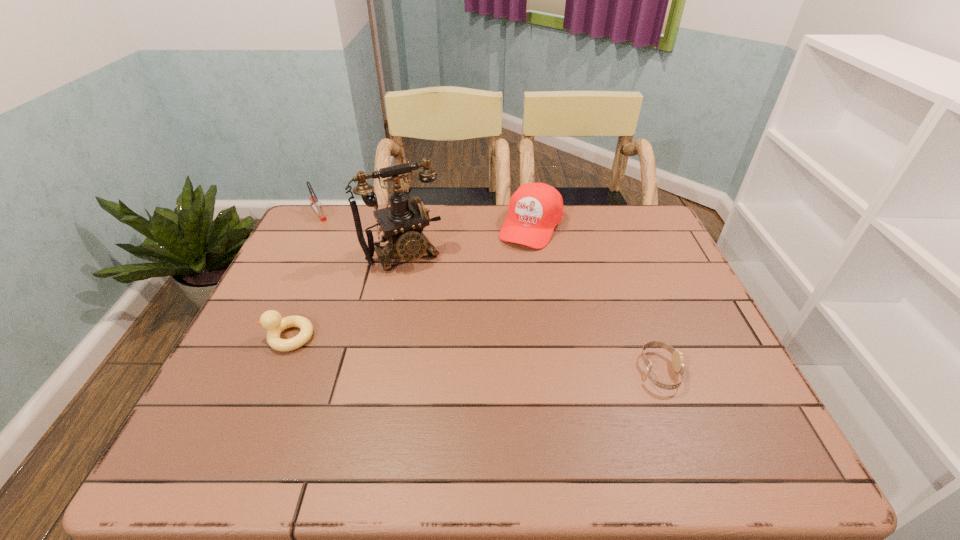
Find the location of a particular element. vacant space located 0.370m on the rotary dial of the tallest object is located at coordinates (473, 367).

Where is `free space located 0.330m on the rotary dial of the tallest object`? free space located 0.330m on the rotary dial of the tallest object is located at coordinates click(x=467, y=354).

Find the location of a particular element. This screenshot has height=540, width=960. free space located on the rotary dial of the tallest object is located at coordinates (471, 363).

I want to click on vacant area located on the front panel of the fourth object from left to right, so click(465, 342).

At what (x,y) coordinates should I click in order to perform the action: click on free space located on the front panel of the fourth object from left to right. Please return your answer as a coordinate pair (x, y). This screenshot has width=960, height=540. Looking at the image, I should click on (515, 259).

You are a GUI agent. You are given a task and a screenshot of the screen. Output one action in this format:
    pyautogui.click(x=<x>, y=<y>)
    Task: Click on the vacant area located 0.360m on the front panel of the fourth object from left to right
    The height and width of the screenshot is (540, 960).
    Given the screenshot: What is the action you would take?
    pyautogui.click(x=471, y=331)

The image size is (960, 540). I want to click on vacant region located on the handle side of the stapler, so click(x=369, y=285).

At what (x,y) coordinates should I click in order to perform the action: click on free space located 0.350m on the handle side of the stapler. Please return your answer as a coordinate pair (x, y). Looking at the image, I should click on (364, 279).

Locate an element on the screen. vacant space located on the handle side of the stapler is located at coordinates (331, 234).

The height and width of the screenshot is (540, 960). I want to click on telephone present at the far edge, so click(402, 223).